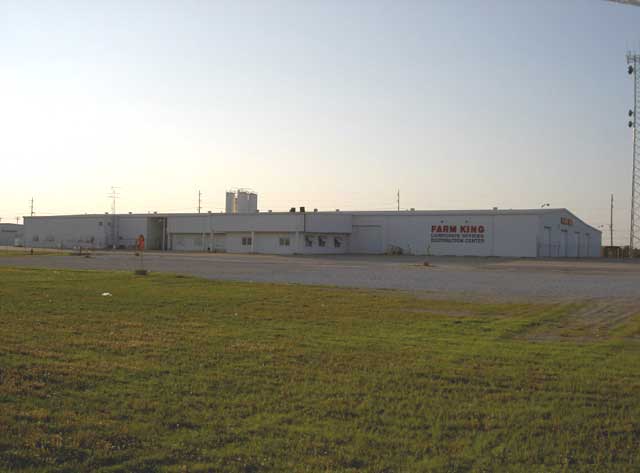
The image size is (640, 473). I want to click on large metallic doors, so click(x=371, y=242), click(x=547, y=244), click(x=562, y=243), click(x=579, y=246), click(x=588, y=247), click(x=6, y=237).